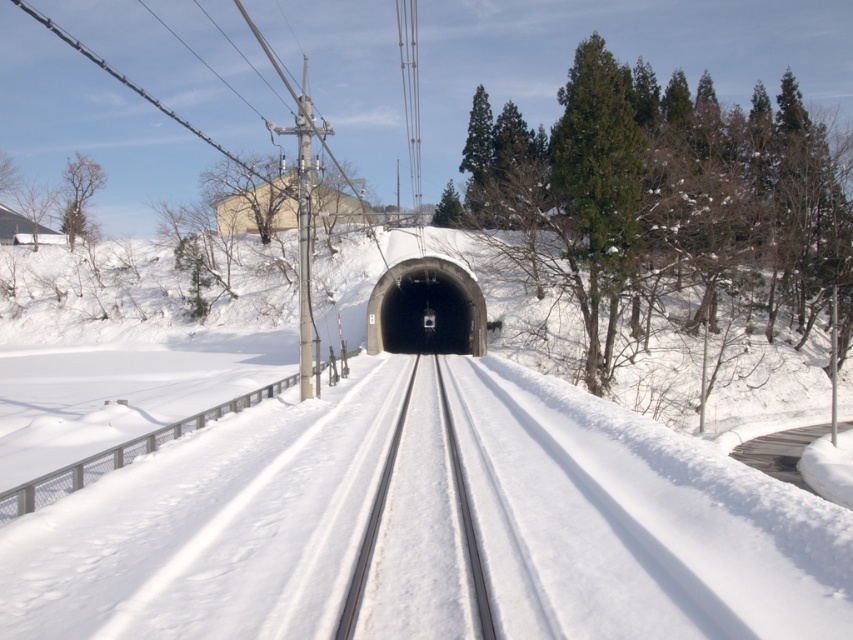
Question: Which object is closer to the camera taking this photo?

Choices:
 (A) smooth steel tracks at center
 (B) black concrete tunnel at center
 (C) metallic wires at center

Answer: (A)

Question: Which point appears closest to the camera in this image?

Choices:
 (A) (460, 508)
 (B) (416, 125)
 (C) (467, 296)

Answer: (A)

Question: Can you confirm if black concrete tunnel at center is smaller than metallic wires at center?

Choices:
 (A) yes
 (B) no

Answer: (A)

Question: Does black concrete tunnel at center appear over smooth steel tracks at center?

Choices:
 (A) yes
 (B) no

Answer: (A)

Question: Is black concrete tunnel at center bigger than metallic wires at center?

Choices:
 (A) yes
 (B) no

Answer: (B)

Question: Which point appears closest to the camera in this image?

Choices:
 (A) (370, 525)
 (B) (405, 301)
 (C) (405, 72)

Answer: (A)